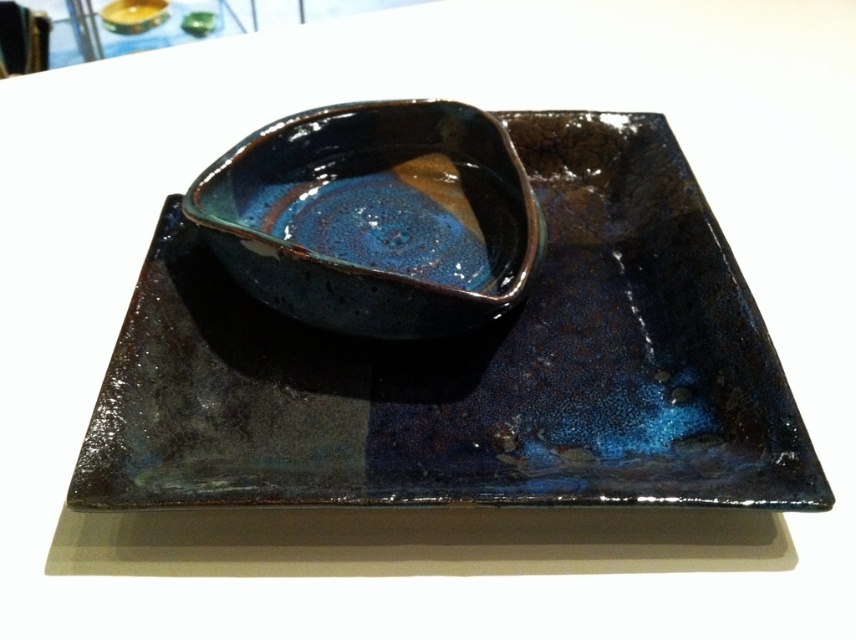
Is glossy ceramic tray at center to the left of glossy ceramic bowl at center from the viewer's perspective?

No, glossy ceramic tray at center is not to the left of glossy ceramic bowl at center.

Is glossy ceramic tray at center shorter than glossy ceramic bowl at center?

In fact, glossy ceramic tray at center may be taller than glossy ceramic bowl at center.

Which is in front, point (742, 454) or point (355, 108)?

Point (742, 454)

You are a GUI agent. You are given a task and a screenshot of the screen. Output one action in this format:
    pyautogui.click(x=<x>, y=<y>)
    Task: Click on the glossy ceramic tray at center
    
    Given the screenshot: What is the action you would take?
    pyautogui.click(x=471, y=368)